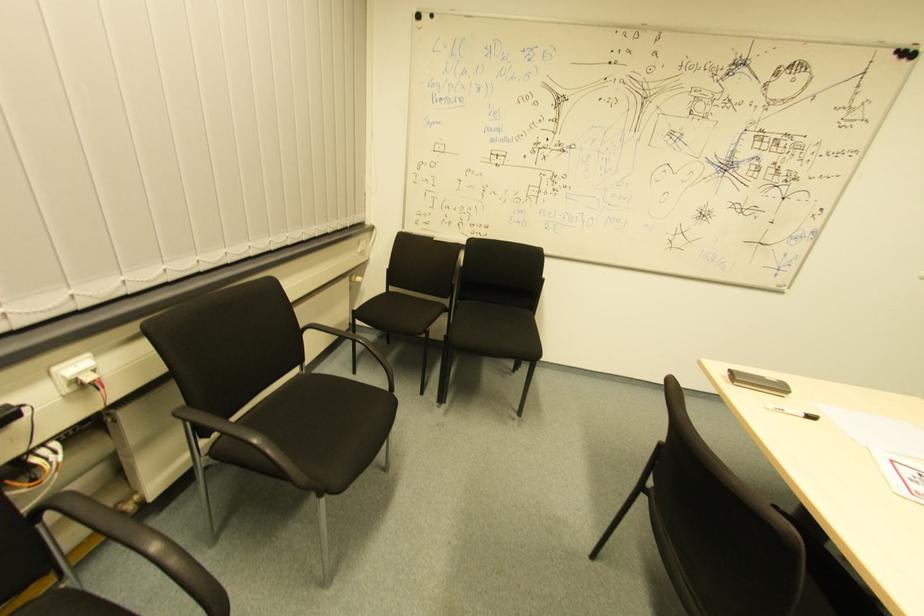
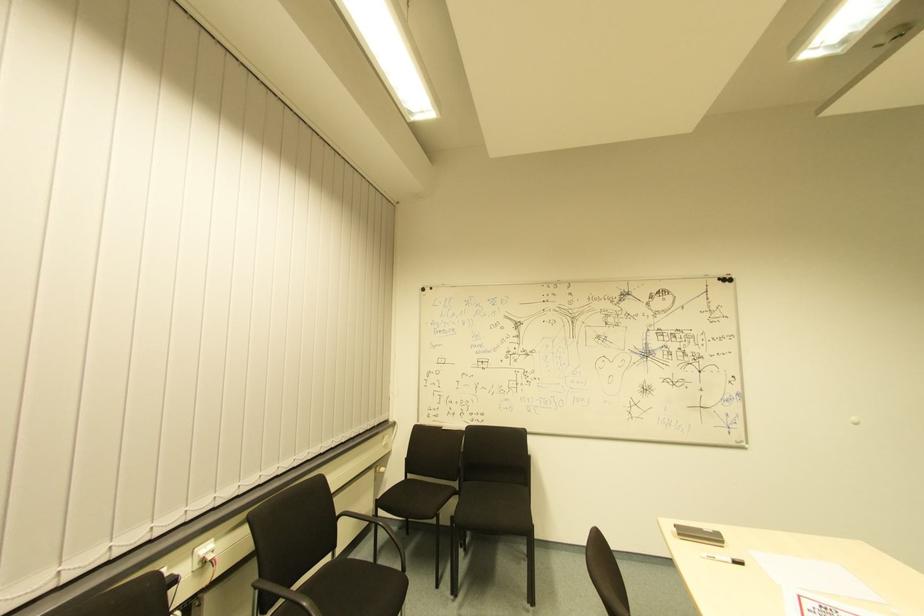
Question: The first image is from the beginning of the video and the second image is from the end. How did the camera likely rotate when shooting the video?

Choices:
 (A) Left
 (B) Right
 (C) Up
 (D) Down

Answer: (C)